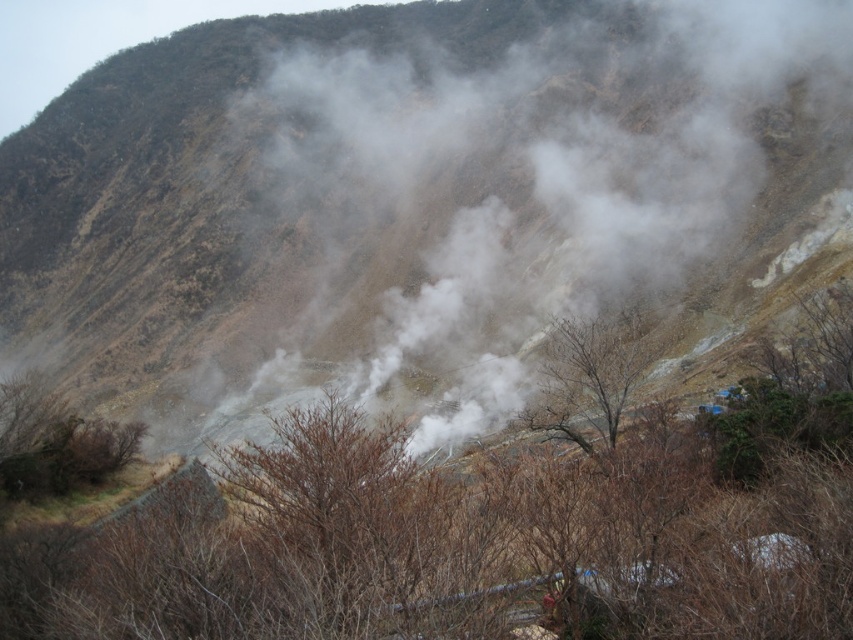
Question: Does brown leafless tree at center have a smaller size compared to brown leafless tree at lower left?

Choices:
 (A) yes
 (B) no

Answer: (B)

Question: Among these points, which one is farthest from the camera?

Choices:
 (A) (842, 451)
 (B) (260, 45)

Answer: (B)

Question: Among these objects, which one is farthest from the camera?

Choices:
 (A) brown leafless tree at center
 (B) brown leafless tree at lower left

Answer: (B)

Question: Can you confirm if brown rocky mountain at center is thinner than brown leafless tree at lower left?

Choices:
 (A) no
 (B) yes

Answer: (A)

Question: Does brown rocky mountain at center come in front of brown leafless tree at center?

Choices:
 (A) no
 (B) yes

Answer: (A)

Question: Which object is closer to the camera taking this photo?

Choices:
 (A) brown leafless tree at center
 (B) brown leafless tree at lower left
 (C) brown rocky mountain at center

Answer: (A)